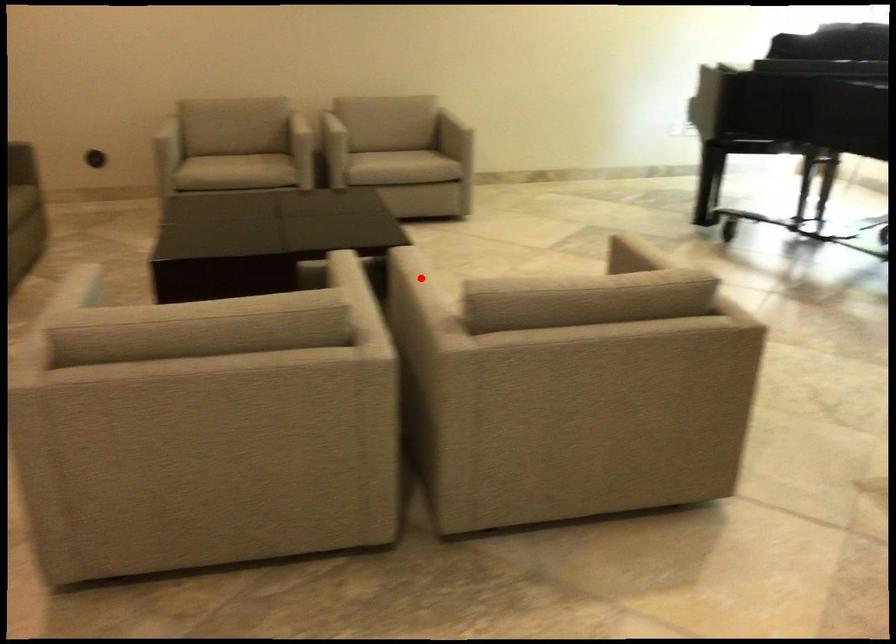
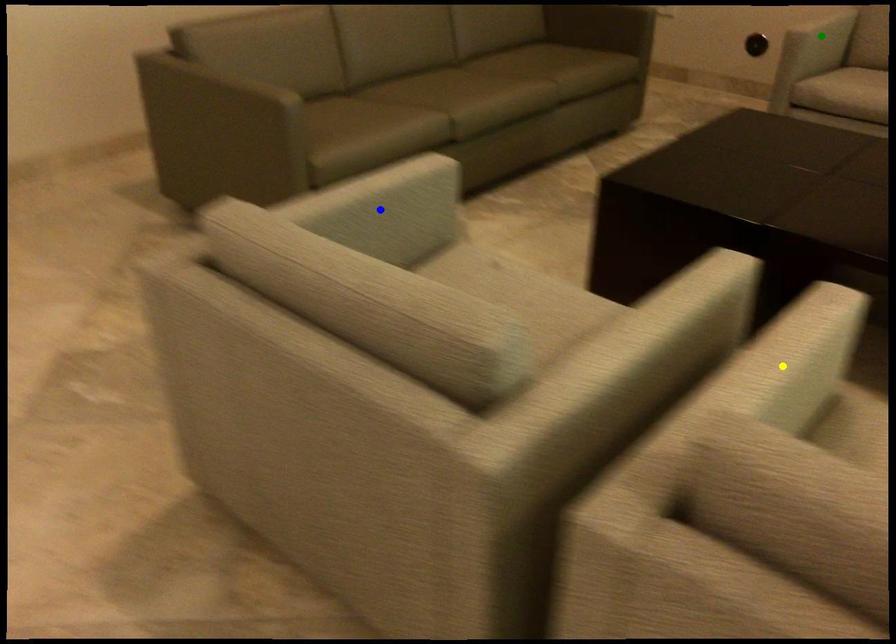
Question: I am providing you with two images of the same scene from different viewpoints. A red point is marked on the first image. You are given multiple points on the second image. Which point in image 2 is actually the same real-world point as the red point in image 1?

Choices:
 (A) green point
 (B) yellow point
 (C) blue point

Answer: (B)